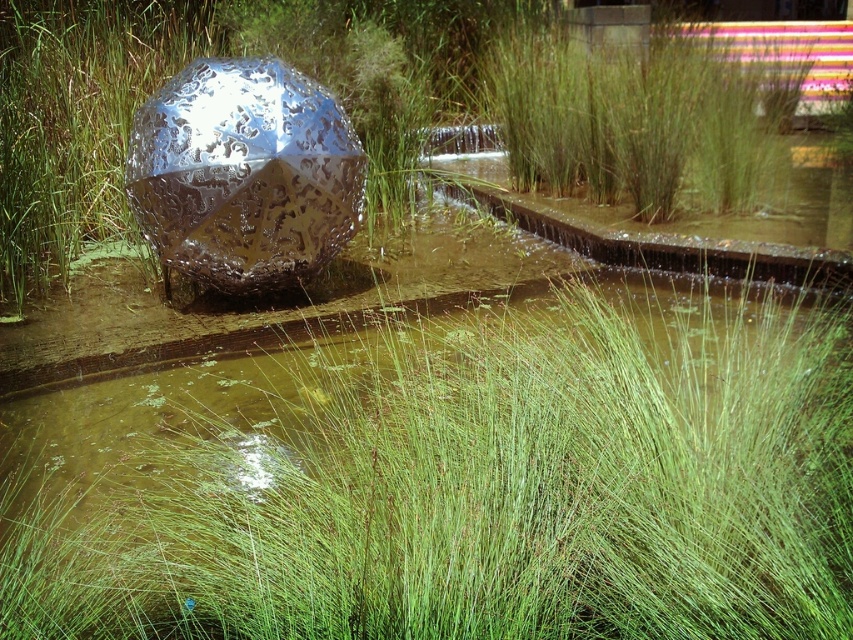
Measure the distance between point (209, 67) and camera.

Point (209, 67) is 5.13 meters from camera.

Is metallic silver disco ball at center smaller than green grass at upper center?

Yes, metallic silver disco ball at center is smaller than green grass at upper center.

Between point (196, 61) and point (728, 76), which one is positioned behind?

The point (728, 76) is more distant.

Locate an element on the screen. This screenshot has width=853, height=640. metallic silver disco ball at center is located at coordinates (244, 173).

Can you confirm if green grass at center is positioned above metallic silver disco ball at center?

Actually, green grass at center is below metallic silver disco ball at center.

Is green grass at center closer to camera compared to metallic silver disco ball at center?

Yes, it is.

Does point (68, 602) lie behind point (270, 243)?

No, (68, 602) is in front of (270, 243).

At what (x,y) coordinates should I click in order to perform the action: click on green grass at center. Please return your answer as a coordinate pair (x, y). The width and height of the screenshot is (853, 640). Looking at the image, I should click on (454, 481).

Between point (213, 502) and point (648, 93), which one is positioned in front?

Point (213, 502) is in front.

Can you confirm if green grass at center is shorter than green grass at upper center?

Correct, green grass at center is not as tall as green grass at upper center.

Who is more distant from viewer, (827, 570) or (564, 172)?

The point (564, 172) is behind.

Locate an element on the screen. The image size is (853, 640). green grass at center is located at coordinates (454, 481).